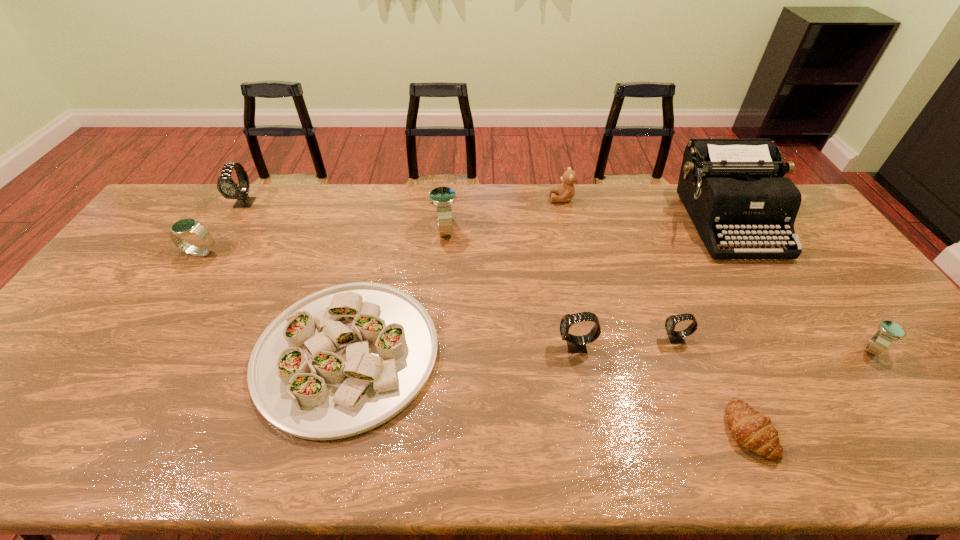
What are the coordinates of `vacant space located on the face of the second smallest gray watch` in the screenshot? It's located at (507, 346).

Find the location of a particular element. The image size is (960, 540). free location located 0.380m on the face of the second smallest gray watch is located at coordinates (410, 346).

The image size is (960, 540). In order to click on free space located on the face of the second smallest gray watch in this screenshot , I will do `click(402, 346)`.

Identify the location of blank space located 0.260m on the face of the brown teddy bear. The image size is (960, 540). (477, 199).

Locate an element on the screen. Image resolution: width=960 pixels, height=540 pixels. free spot located 0.060m on the face of the brown teddy bear is located at coordinates (533, 199).

Where is `free region located on the face of the brown teddy bear`? The image size is (960, 540). free region located on the face of the brown teddy bear is located at coordinates (464, 199).

Locate an element on the screen. This screenshot has height=540, width=960. vacant space positioned 0.360m on the right of the second smallest blue watch is located at coordinates (335, 253).

Where is `blank area located 0.190m on the face of the smallest gray watch`? Image resolution: width=960 pixels, height=540 pixels. blank area located 0.190m on the face of the smallest gray watch is located at coordinates (588, 339).

The image size is (960, 540). What are the coordinates of `free space located on the face of the smallest gray watch` in the screenshot? It's located at (581, 339).

This screenshot has width=960, height=540. Find the location of `vacant area located on the face of the smallest gray watch`. vacant area located on the face of the smallest gray watch is located at coordinates (573, 339).